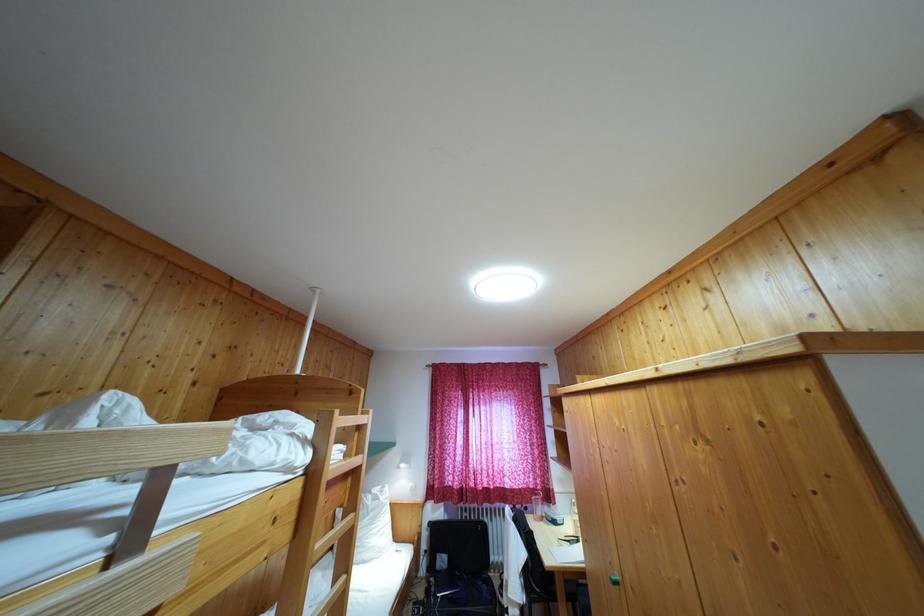
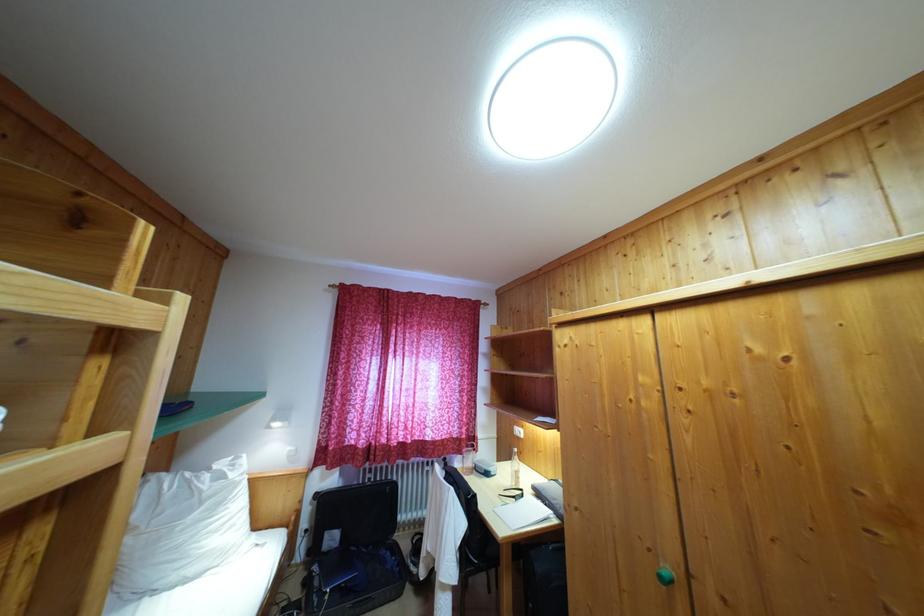
Question: Based on the continuous images, in which direction is the camera rotating? Reply with the corresponding letter.

Choices:
 (A) Left
 (B) Right
 (C) Up
 (D) Down

Answer: (B)